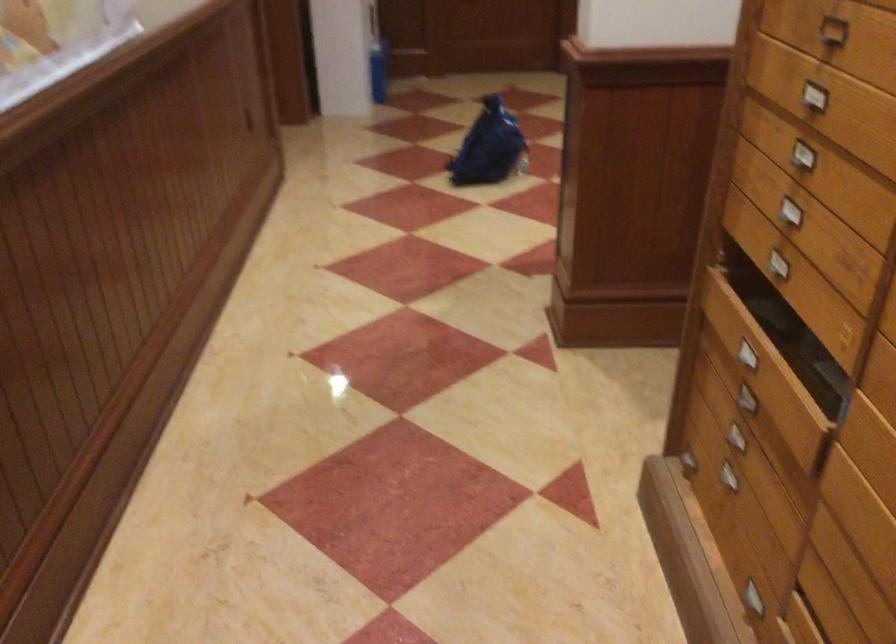
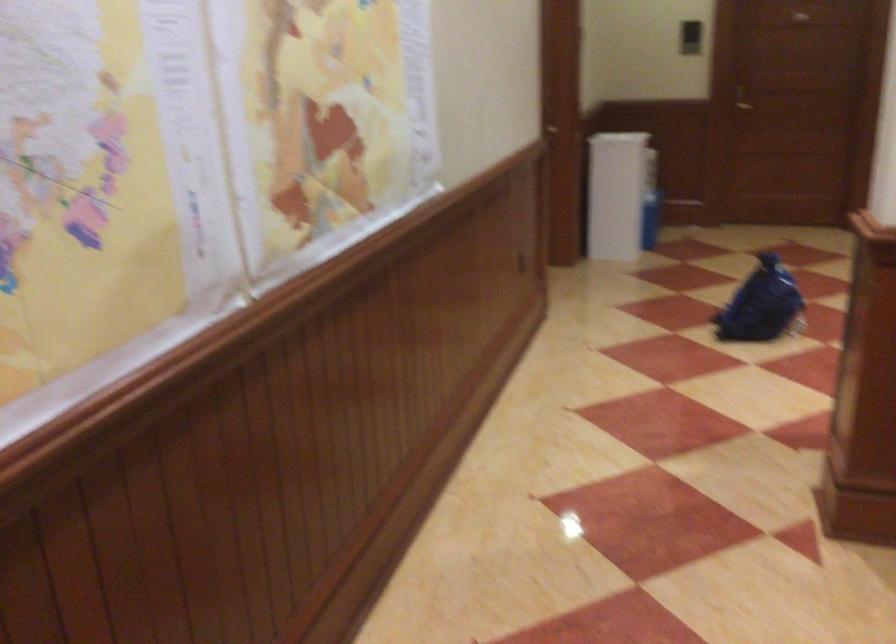
In a continuous first-person perspective shot, in which direction is the camera moving?

The movement direction of the cameraman is left, backward.